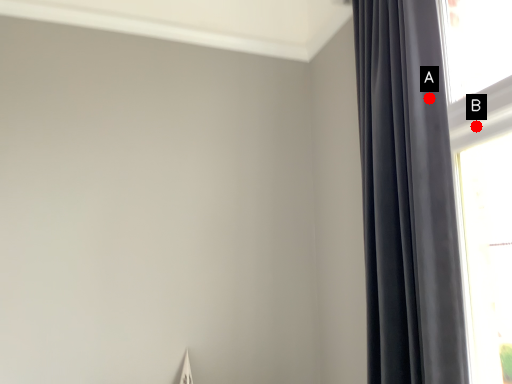
Question: Two points are circled on the image, labeled by A and B beside each circle. Which point is farther from the camera taking this photo?

Choices:
 (A) A is further
 (B) B is further

Answer: (B)